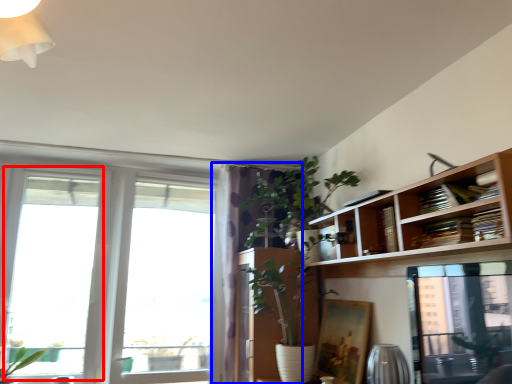
Question: Which point is further to the camera, window (highlighted by a red box) or curtain (highlighted by a blue box)?

Choices:
 (A) window
 (B) curtain

Answer: (B)